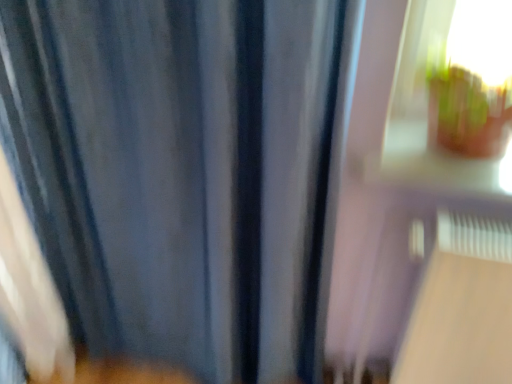
Question: From the image's perspective, is transparent glass window at upper right located above or below blue fabric curtain at center?

Choices:
 (A) below
 (B) above

Answer: (B)

Question: In terms of width, does transparent glass window at upper right look wider or thinner when compared to blue fabric curtain at center?

Choices:
 (A) thin
 (B) wide

Answer: (B)

Question: Would you say transparent glass window at upper right is inside or outside blue fabric curtain at center?

Choices:
 (A) inside
 (B) outside

Answer: (B)

Question: In terms of width, does blue fabric curtain at center look wider or thinner when compared to transparent glass window at upper right?

Choices:
 (A) thin
 (B) wide

Answer: (A)

Question: From a real-world perspective, is blue fabric curtain at center physically located above or below transparent glass window at upper right?

Choices:
 (A) above
 (B) below

Answer: (B)

Question: In the image, is blue fabric curtain at center on the left side or the right side of transparent glass window at upper right?

Choices:
 (A) right
 (B) left

Answer: (B)

Question: Considering their positions, is blue fabric curtain at center located in front of or behind transparent glass window at upper right?

Choices:
 (A) front
 (B) behind

Answer: (A)